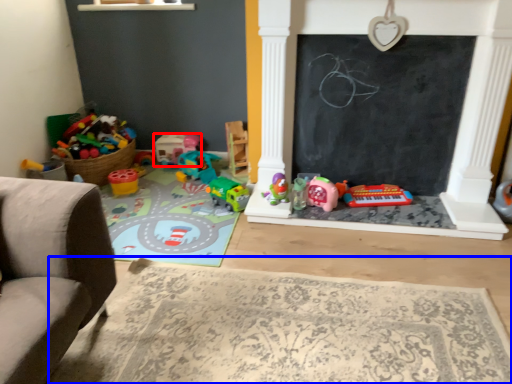
Question: Among these objects, which one is farthest to the camera, toy (highlighted by a red box) or mat (highlighted by a blue box)?

Choices:
 (A) toy
 (B) mat

Answer: (A)